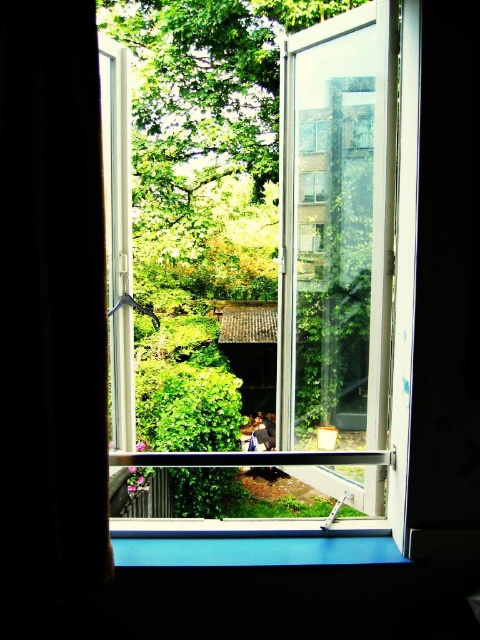
You are standing in the room looking through the open window. There is a point marked at coordinates (51, 324). What object is this point located on?

The point at (51, 324) is located on the black fabric curtain at left.

You are standing in the room and want to see the green leafy tree at center outside through the clear glass window at center. Can you see the tree clearly through the window?

The clear glass window at center is further to the viewer than green leafy tree at center, so the tree is behind the window, making it possible to see the tree clearly through the window.

You are an interior designer assessing the room layout. You need to determine if the clear glass window at center can accommodate a large decorative item that requires a space wider than the green leafy tree at center. Based on the scene, is this possible?

The clear glass window at center has a lesser width compared to the green leafy tree at center, so it cannot accommodate a decorative item requiring a space wider than the tree.